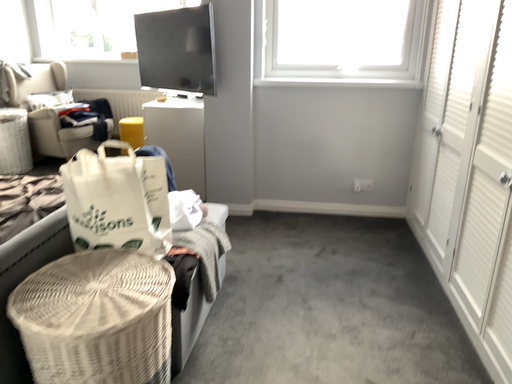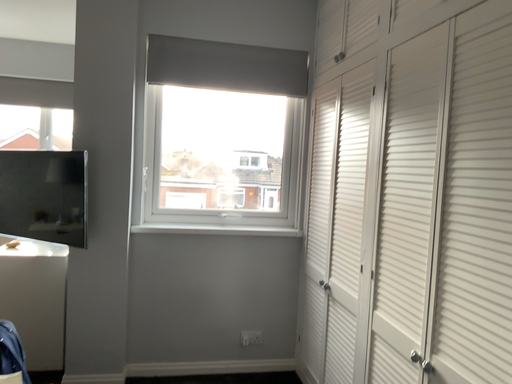
Question: Which way did the camera rotate in the video?

Choices:
 (A) rotated downward
 (B) rotated upward

Answer: (B)